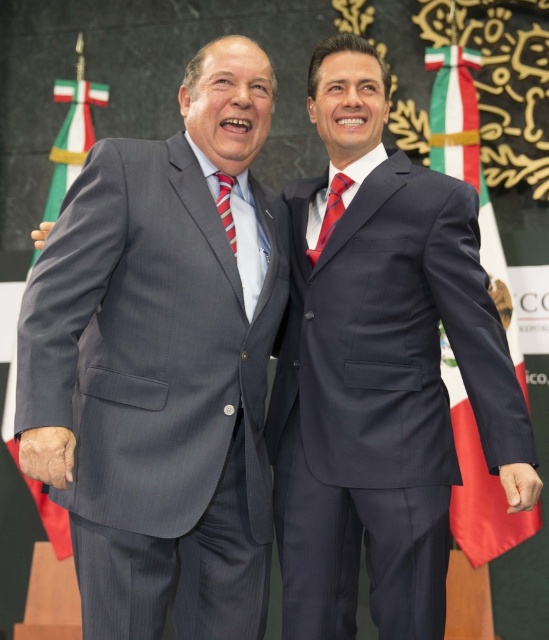
Who is lower down, navy blue suit at center or silky red tie at center?

Positioned lower is navy blue suit at center.

Does navy blue suit at center have a lesser height compared to silky red tie at center?

No, navy blue suit at center is not shorter than silky red tie at center.

Is point (429, 410) positioned behind point (327, 227)?

That is False.

This screenshot has height=640, width=549. Find the location of `navy blue suit at center`. navy blue suit at center is located at coordinates (380, 371).

Looking at this image, can you confirm if gray pinstripe suit at left is positioned above red fabric flag at right?

Incorrect, gray pinstripe suit at left is not positioned above red fabric flag at right.

The image size is (549, 640). Find the location of `gray pinstripe suit at left`. gray pinstripe suit at left is located at coordinates (163, 364).

Which is more to the left, gray pinstripe suit at left or navy blue suit at center?

gray pinstripe suit at left is more to the left.

Where is `gray pinstripe suit at left`? The height and width of the screenshot is (640, 549). gray pinstripe suit at left is located at coordinates (163, 364).